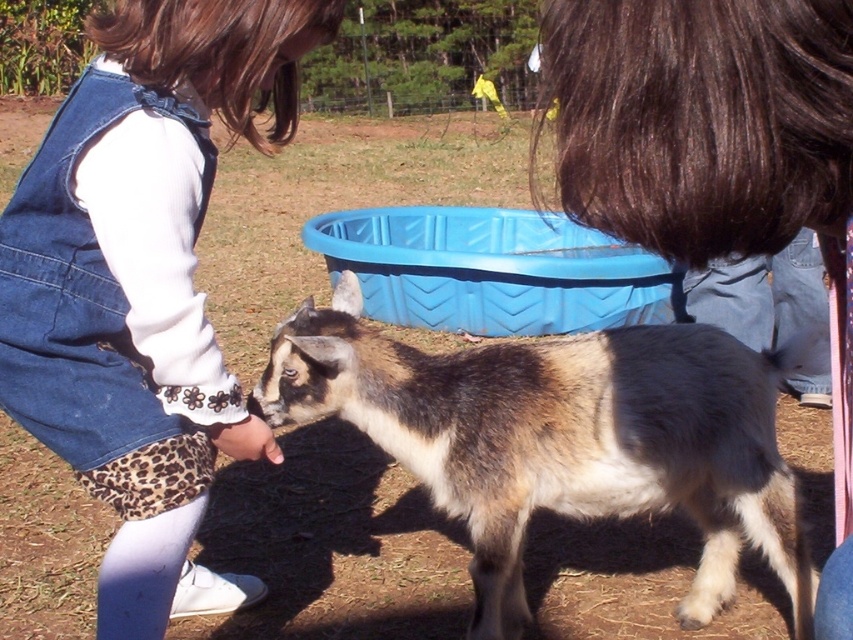
Question: Which object appears farthest from the camera in this image?

Choices:
 (A) denim overalls at center
 (B) dark brown hair at upper center
 (C) brown and white fur goat at center

Answer: (C)

Question: Is denim overalls at center in front of brown and white fur goat at center?

Choices:
 (A) no
 (B) yes

Answer: (B)

Question: Which of the following is the farthest from the observer?

Choices:
 (A) denim overalls at center
 (B) brown and white fur goat at center
 (C) dark brown hair at upper center

Answer: (B)

Question: Is denim overalls at center wider than dark brown hair at upper center?

Choices:
 (A) no
 (B) yes

Answer: (B)

Question: Does brown and white fur goat at center have a greater width compared to dark brown hair at upper center?

Choices:
 (A) no
 (B) yes

Answer: (B)

Question: Among these points, which one is farthest from the camera?

Choices:
 (A) (671, 141)
 (B) (189, 602)
 (C) (549, 499)

Answer: (B)